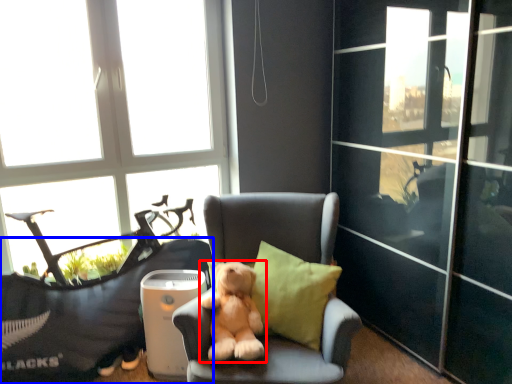
Question: Which object is closer to the camera taking this photo, dog (highlighted by a red box) or furniture (highlighted by a blue box)?

Choices:
 (A) dog
 (B) furniture

Answer: (A)